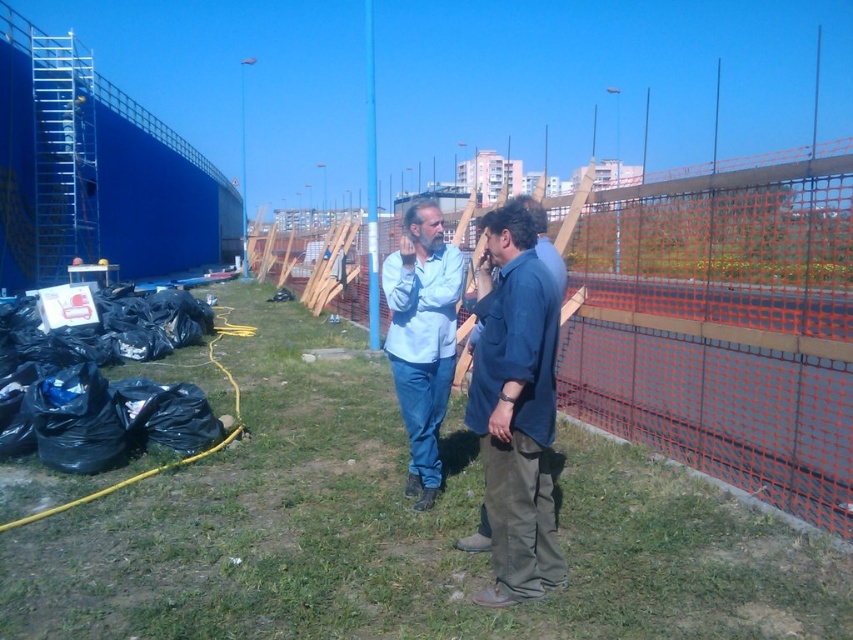
You are a delivery person who needs to place a package between the orange mesh fence at center and the blue cotton shirt at center. The package requires 1 meter of space. Can you fit it there?

The orange mesh fence at center and blue cotton shirt at center are 1.13 meters apart. Since the package requires 1 meter of space, it can fit between them as the available space is more than enough.